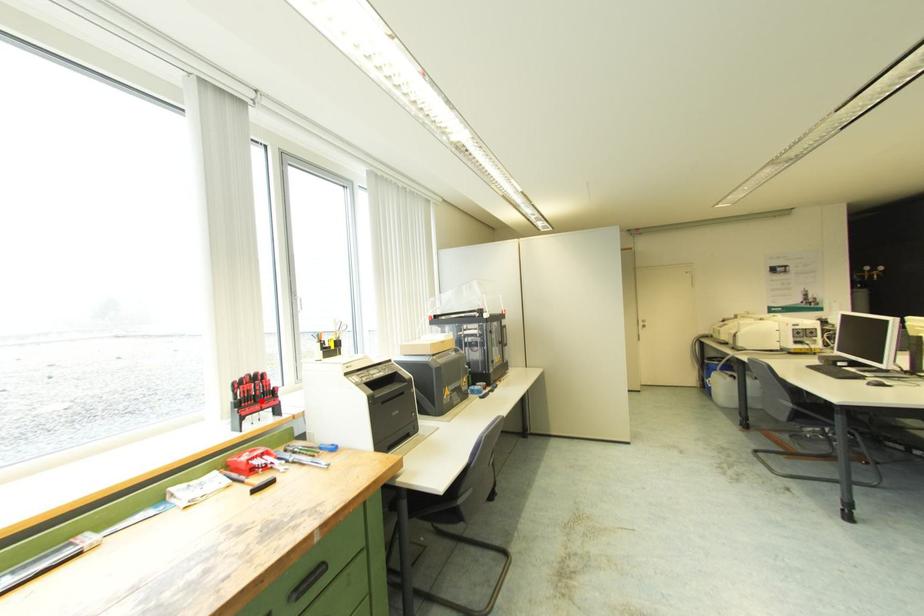
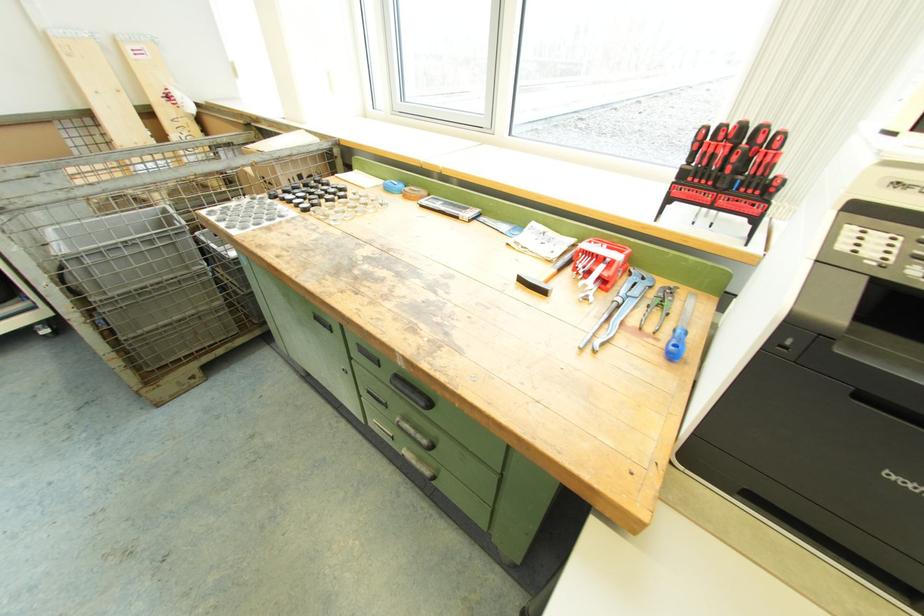
The point at the highlighted location is marked in the first image. Where is the corresponding point in the second image?

(723, 185)